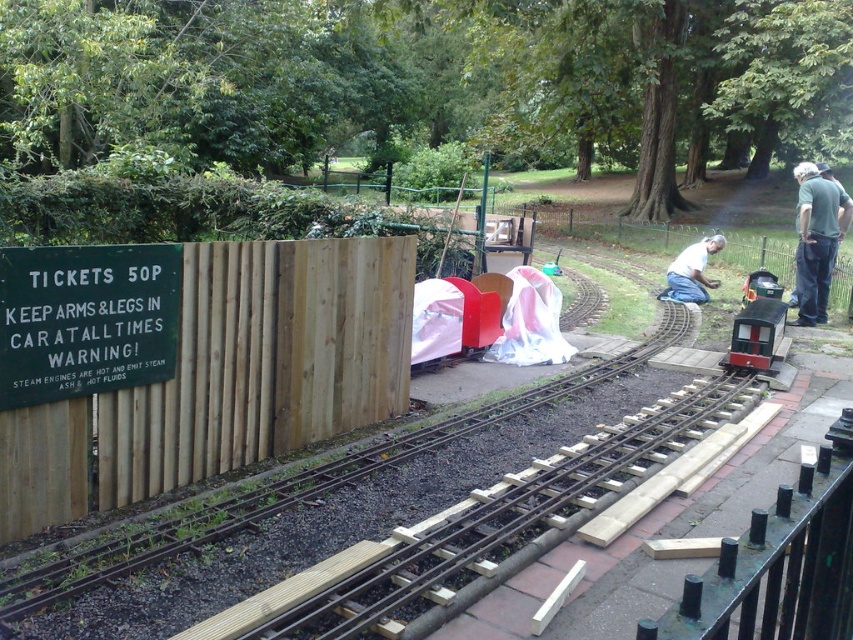
Question: Which point is closer to the camera?

Choices:
 (A) white shirt at center
 (B) metallic green train at center
 (C) gray fabric at right

Answer: (B)

Question: Which object is farther from the camera taking this photo?

Choices:
 (A) metallic green train at center
 (B) gray fabric at right

Answer: (B)

Question: Does gray fabric at right have a smaller size compared to white shirt at center?

Choices:
 (A) yes
 (B) no

Answer: (A)

Question: Does metallic green train at center appear on the left side of white shirt at center?

Choices:
 (A) no
 (B) yes

Answer: (B)

Question: Does gray fabric at right come behind metallic green train at center?

Choices:
 (A) yes
 (B) no

Answer: (A)

Question: Which of the following is the closest to the observer?

Choices:
 (A) (706, 298)
 (B) (805, 205)
 (C) (740, 356)

Answer: (C)